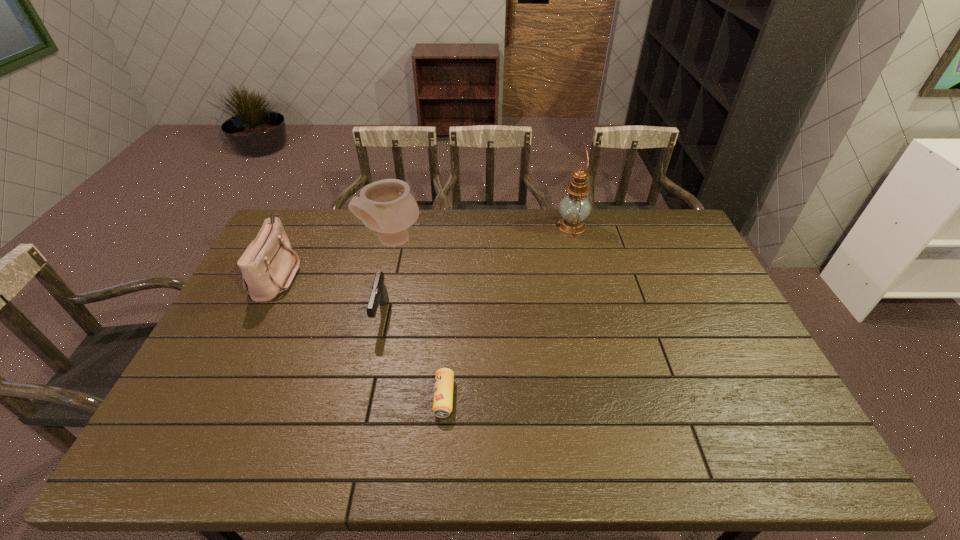
Locate which object ranks third in proximity to the shortest object. Please provide its 2D coordinates. Your answer should be formatted as a tuple, i.e. [(x, y)], where the tuple contains the x and y coordinates of a point satisfying the conditions above.

[(268, 265)]

This screenshot has height=540, width=960. Identify the location of object that is the third closest one to the second shortest object. (268, 265).

Image resolution: width=960 pixels, height=540 pixels. I want to click on free space that satisfies the following two spatial constraints: 1. on the front pocket of the beer can; 2. on the left side of the shoulder bag, so click(218, 397).

Where is `free space that satisfies the following two spatial constraints: 1. aim along the barrel of the second shortest object; 2. on the left side of the nearest object`? Image resolution: width=960 pixels, height=540 pixels. free space that satisfies the following two spatial constraints: 1. aim along the barrel of the second shortest object; 2. on the left side of the nearest object is located at coordinates (363, 397).

Locate an element on the screen. The height and width of the screenshot is (540, 960). vacant space that satisfies the following two spatial constraints: 1. on the front side of the fourth object from left to right; 2. on the right side of the pottery is located at coordinates (356, 397).